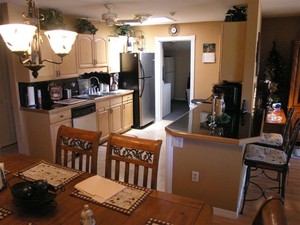
What are the coordinates of `outlet` in the screenshot? It's located at (195, 175).